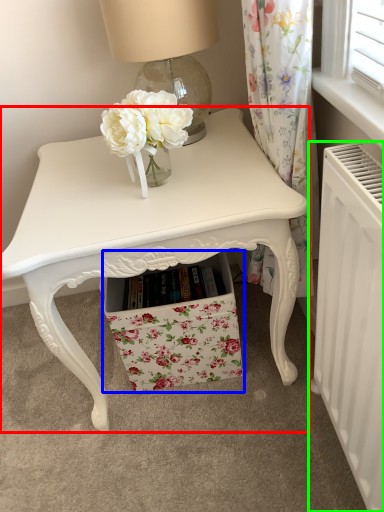
Question: Estimate the real-world distances between objects in this image. Which object is farther from table (highlighted by a red box), drawer (highlighted by a blue box) or radiator (highlighted by a green box)?

Choices:
 (A) drawer
 (B) radiator

Answer: (B)